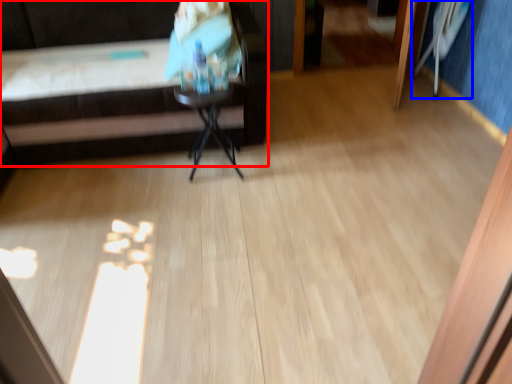
Question: Which point is further to the camera, furniture (highlighted by a red box) or swivel chair (highlighted by a blue box)?

Choices:
 (A) furniture
 (B) swivel chair

Answer: (B)